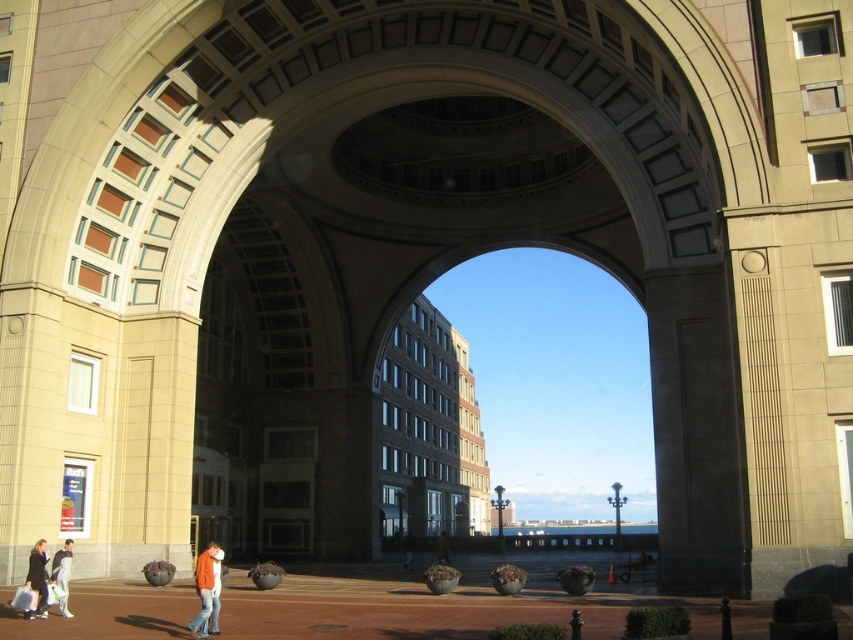
You are a photographer trying to capture a photo of the orange cotton jacket at lower left and the dark gray jacket at center. Which jacket should you zoom in on to ensure both are fully visible in the frame?

The orange cotton jacket at lower left might be wider than dark gray jacket at center, so you should zoom in on the dark gray jacket at center to ensure both are fully visible in the frame.

You are standing at the base of the archway and notice two jackets lying on the ground. The light brown leather jacket at lower left and the dark gray jacket at center. Which jacket is shorter in height?

The light brown leather jacket at lower left is shorter than the dark gray jacket at center.